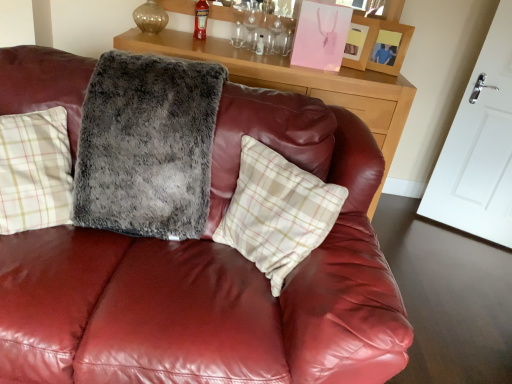
Question: Does red glass bottle at upper center have a lesser height compared to wooden cabinet at upper center?

Choices:
 (A) no
 (B) yes

Answer: (B)

Question: Would you consider red glass bottle at upper center to be distant from wooden cabinet at upper center?

Choices:
 (A) no
 (B) yes

Answer: (A)

Question: Is wooden cabinet at upper center located within red glass bottle at upper center?

Choices:
 (A) no
 (B) yes

Answer: (A)

Question: From the image's perspective, would you say red glass bottle at upper center is positioned over wooden cabinet at upper center?

Choices:
 (A) yes
 (B) no

Answer: (A)

Question: Is red glass bottle at upper center to the left of wooden cabinet at upper center from the viewer's perspective?

Choices:
 (A) no
 (B) yes

Answer: (B)

Question: Is red glass bottle at upper center thinner than wooden cabinet at upper center?

Choices:
 (A) no
 (B) yes

Answer: (B)

Question: From the image's perspective, would you say red glass bottle at upper center is positioned over fuzzy gray blanket at center?

Choices:
 (A) no
 (B) yes

Answer: (B)

Question: From a real-world perspective, is red glass bottle at upper center under fuzzy gray blanket at center?

Choices:
 (A) no
 (B) yes

Answer: (A)

Question: From a real-world perspective, is red glass bottle at upper center over fuzzy gray blanket at center?

Choices:
 (A) yes
 (B) no

Answer: (A)

Question: Is there a large distance between red glass bottle at upper center and fuzzy gray blanket at center?

Choices:
 (A) no
 (B) yes

Answer: (B)

Question: Does red glass bottle at upper center have a smaller size compared to fuzzy gray blanket at center?

Choices:
 (A) yes
 (B) no

Answer: (A)

Question: Can fuzzy gray blanket at center be found inside red glass bottle at upper center?

Choices:
 (A) no
 (B) yes

Answer: (A)

Question: Can you confirm if white plaid pillow at center is smaller than wooden picture frame at upper right, the second picture frame in the left-to-right sequence?

Choices:
 (A) yes
 (B) no

Answer: (B)